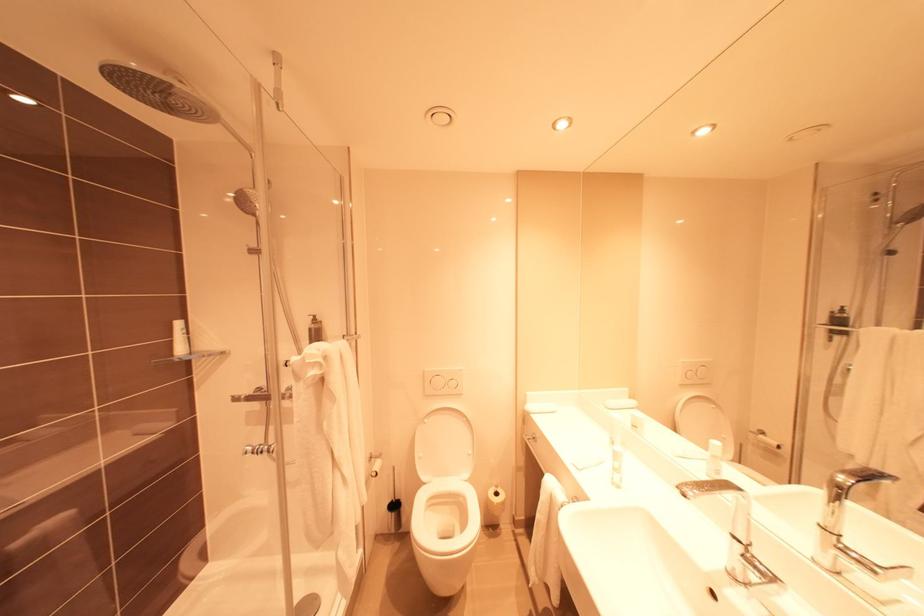
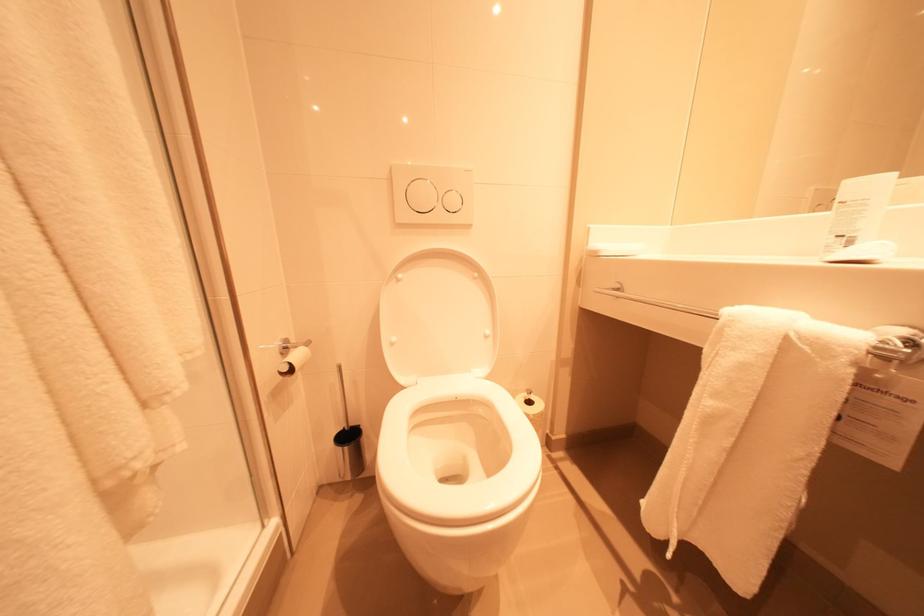
Question: The images are taken continuously from a first-person perspective. In which direction are you moving?

Choices:
 (A) Left
 (B) Right
 (C) Forward
 (D) Backward

Answer: (C)